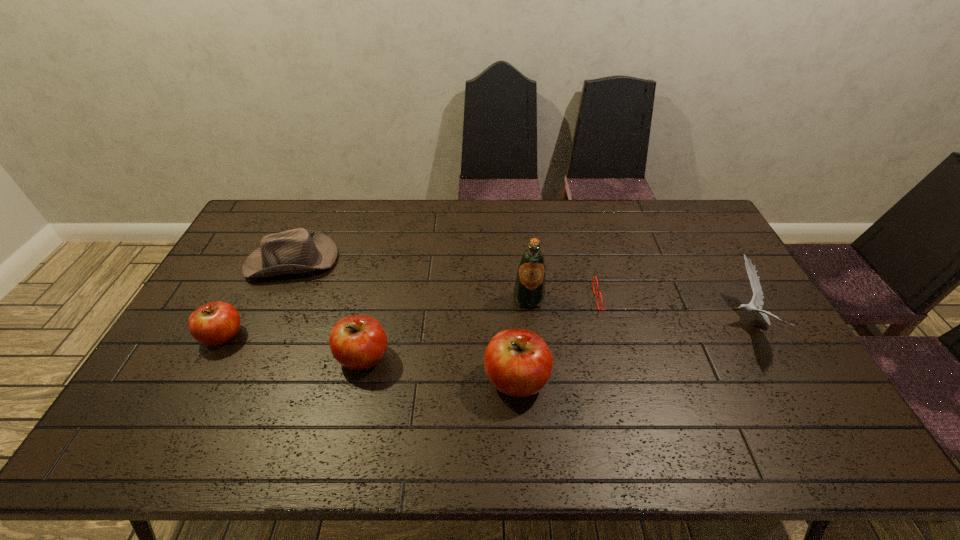
In the current image, all apples are evenly spaced. To maintain this equal spacing, where should an additional apple be placed on the right? Please point out a free spot. Please provide its 2D coordinates. Your answer should be formatted as a tuple, i.e. [(x, y)], where the tuple contains the x and y coordinates of a point satisfying the conditions above.

[(684, 405)]